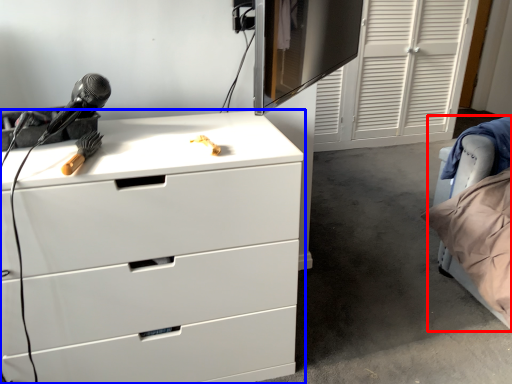
Question: Which of the following is the farthest to the observer, bed (highlighted by a red box) or chest of drawers (highlighted by a blue box)?

Choices:
 (A) bed
 (B) chest of drawers

Answer: (A)